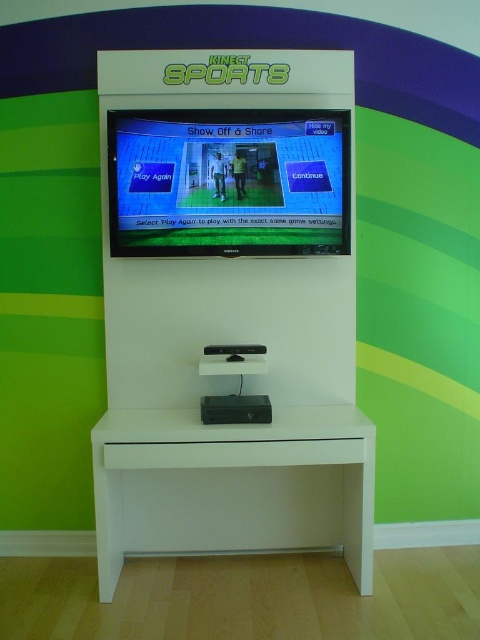
Question: Can you confirm if white matte table at center is positioned above matte black screen at center?

Choices:
 (A) yes
 (B) no

Answer: (B)

Question: Which object is farther from the camera taking this photo?

Choices:
 (A) white matte table at center
 (B) matte black screen at center

Answer: (B)

Question: Does white matte table at center have a lesser width compared to matte black screen at center?

Choices:
 (A) no
 (B) yes

Answer: (A)

Question: Which object is closer to the camera taking this photo?

Choices:
 (A) white glossy entertainment center at center
 (B) white matte table at center
 (C) matte black screen at center

Answer: (B)

Question: Based on their relative distances, which object is farther from the matte black screen at center?

Choices:
 (A) white matte table at center
 (B) white glossy entertainment center at center

Answer: (A)

Question: Can you confirm if white glossy entertainment center at center is positioned to the left of matte black screen at center?

Choices:
 (A) no
 (B) yes

Answer: (B)